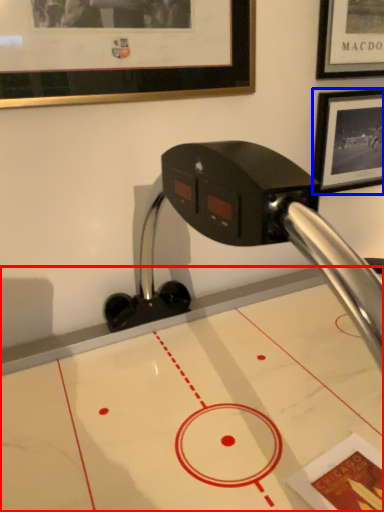
Question: Which of the following is the closest to the observer, table (highlighted by a red box) or picture frame (highlighted by a blue box)?

Choices:
 (A) table
 (B) picture frame

Answer: (A)